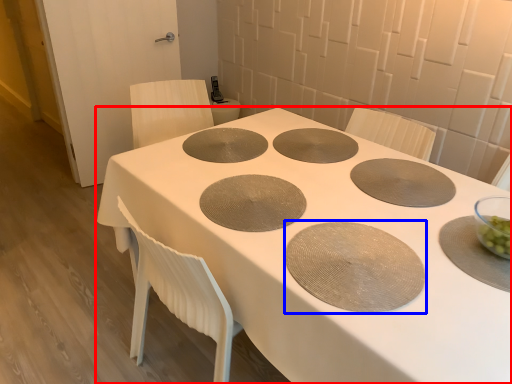
Question: Which of the following is the farthest to the observer, table (highlighted by a red box) or oval (highlighted by a blue box)?

Choices:
 (A) table
 (B) oval

Answer: (B)